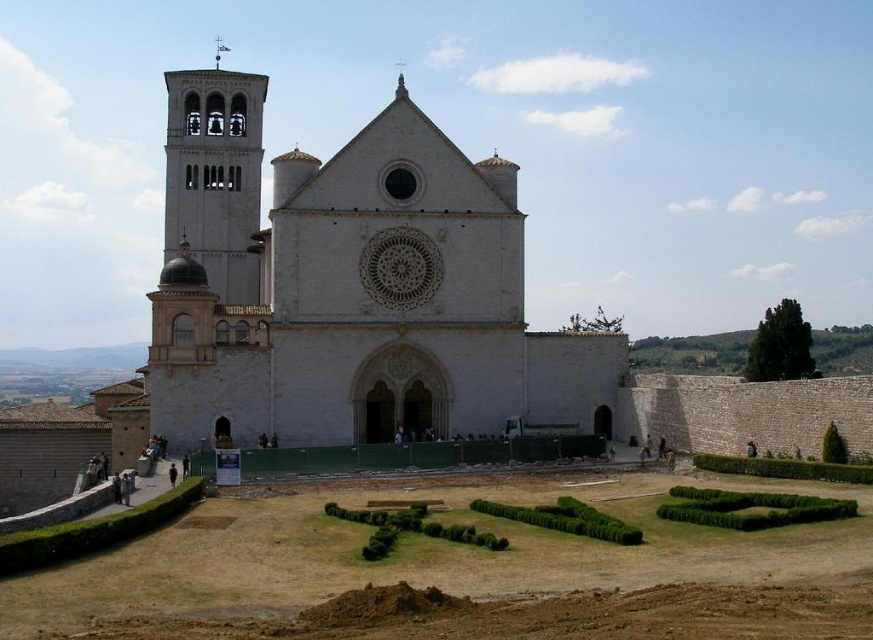
Question: Does green bushy hedge at lower center appear on the right side of dark brown leather jacket at lower right?

Choices:
 (A) yes
 (B) no

Answer: (B)

Question: Which point is closer to the camera?

Choices:
 (A) (172, 470)
 (B) (820, 518)
 (C) (361, 522)
 (D) (569, 512)

Answer: (B)

Question: Which is farther from the green bushy hedge at lower center?

Choices:
 (A) green shrubbery at center
 (B) white stone bell tower at left
 (C) green leafy hedge at lower right

Answer: (B)

Question: Can you confirm if white stone bell tower at left is positioned to the right of dark brown leather jacket at lower right?

Choices:
 (A) yes
 (B) no

Answer: (B)

Question: Can you confirm if white stone bell tower at left is positioned to the right of green leafy hedge at center?

Choices:
 (A) yes
 (B) no

Answer: (B)

Question: Which point appears farthest from the camera in this image?

Choices:
 (A) (332, 515)
 (B) (575, 528)
 (C) (432, 227)
 (D) (801, 506)

Answer: (C)